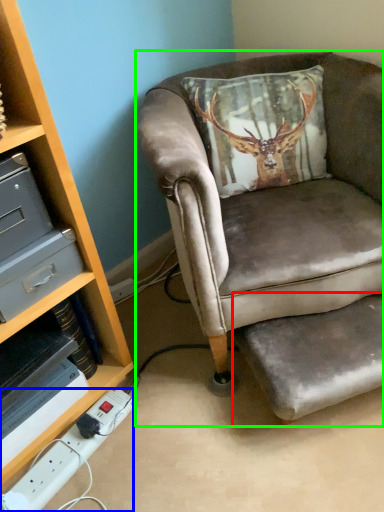
Question: Based on their relative distances, which object is nearer to footrest (highlighted by a red box)? Choose from power outlet (highlighted by a blue box) and chair (highlighted by a green box).

Choices:
 (A) power outlet
 (B) chair

Answer: (B)